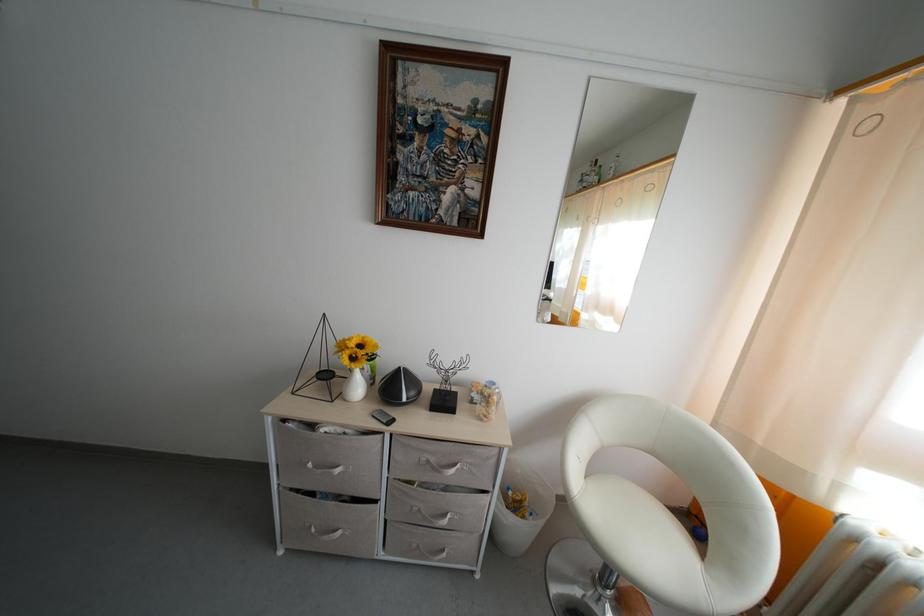
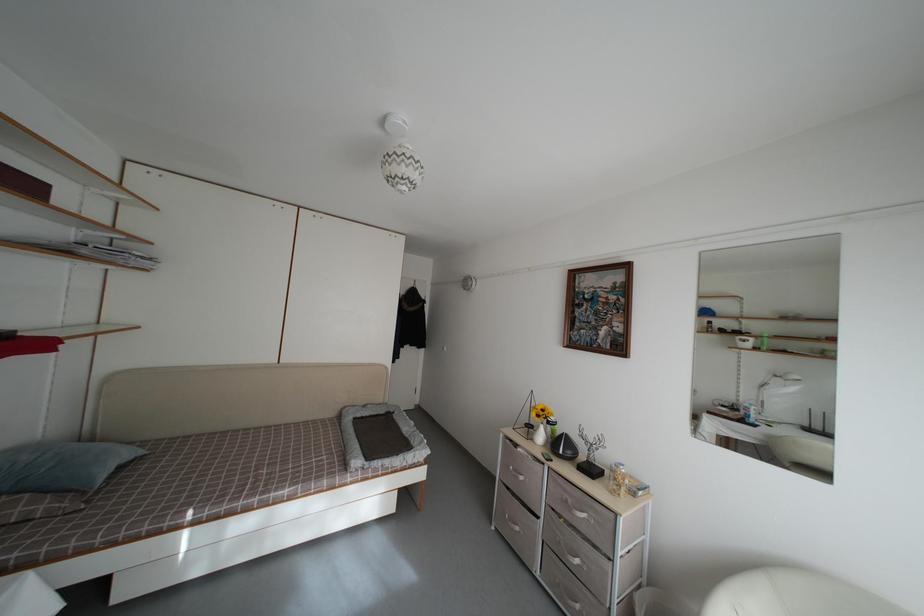
How did the camera likely rotate?

The camera's rotation is toward left-up.